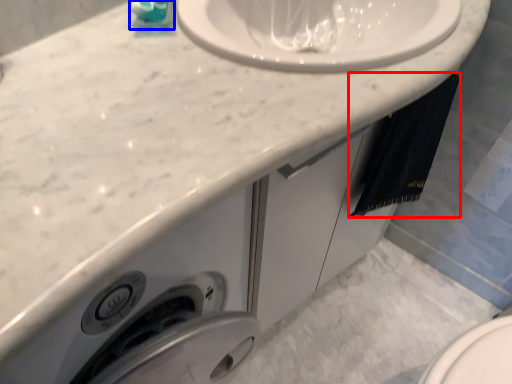
Question: Which point is closer to the camera, bath towel (highlighted by a red box) or soap dispenser (highlighted by a blue box)?

Choices:
 (A) bath towel
 (B) soap dispenser

Answer: (B)